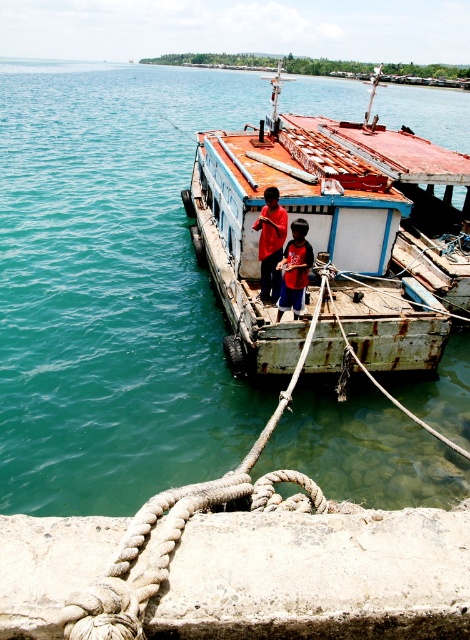
Question: Can you confirm if teal water at center is positioned to the left of rusty concrete ledge at lower center?

Choices:
 (A) no
 (B) yes

Answer: (B)

Question: Which point is closer to the camera?

Choices:
 (A) teal water at center
 (B) rope at center
 (C) rusty concrete ledge at lower center
 (D) red cotton shirt at center

Answer: (C)

Question: Which point is farther to the camera?

Choices:
 (A) [x=305, y=269]
 (B) [x=365, y=275]
 (C) [x=253, y=444]

Answer: (B)

Question: Which point is closer to the camera?

Choices:
 (A) dark blue shorts at center
 (B) teal water at center
 (C) rope at center

Answer: (C)

Question: Is teal water at center positioned in front of rusty concrete ledge at lower center?

Choices:
 (A) no
 (B) yes

Answer: (A)

Question: Considering the relative positions of rusty metal boat at center and red cotton shirt at center in the image provided, where is rusty metal boat at center located with respect to red cotton shirt at center?

Choices:
 (A) left
 (B) right

Answer: (B)